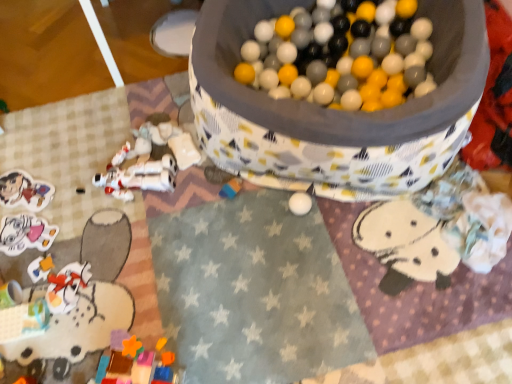
Where is `vacant space in front of matte white sticker at lower left, which appears as the 2th toy when viewed from the left`? The width and height of the screenshot is (512, 384). vacant space in front of matte white sticker at lower left, which appears as the 2th toy when viewed from the left is located at coordinates (33, 281).